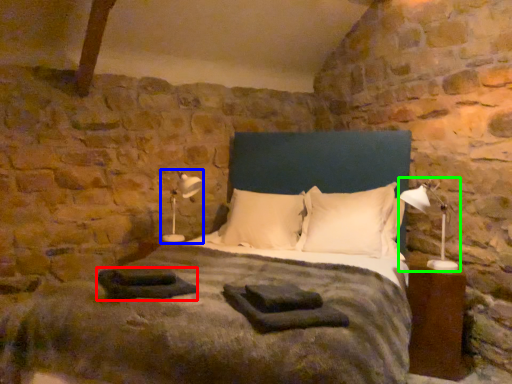
Question: Considering the real-world distances, which object is farthest from material (highlighted by a red box)? table lamp (highlighted by a blue box) or table lamp (highlighted by a green box)?

Choices:
 (A) table lamp
 (B) table lamp

Answer: (B)